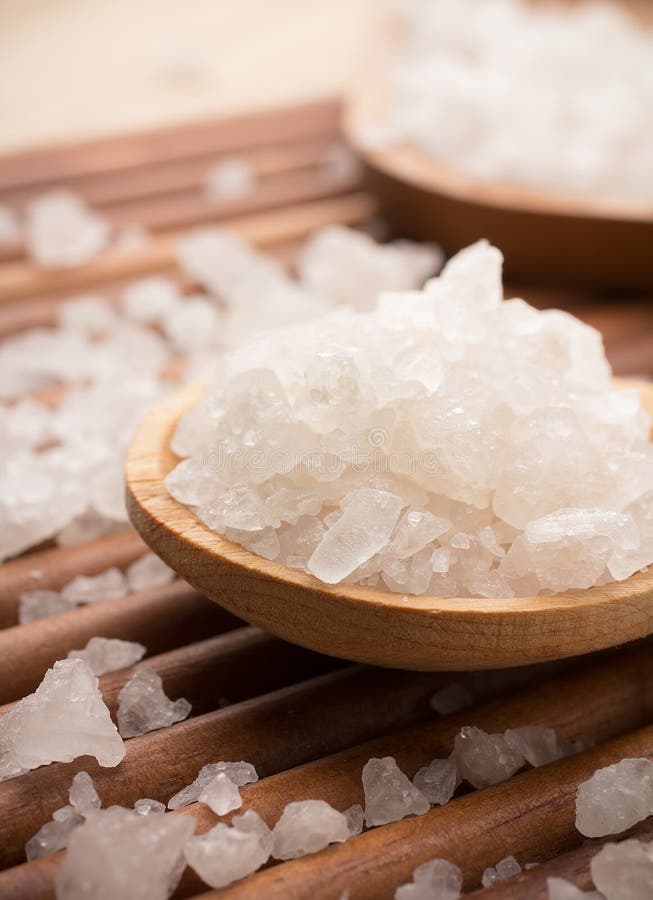
The width and height of the screenshot is (653, 900). What are the coordinates of `wooden bowl in upper right corner` in the screenshot? It's located at (510, 213).